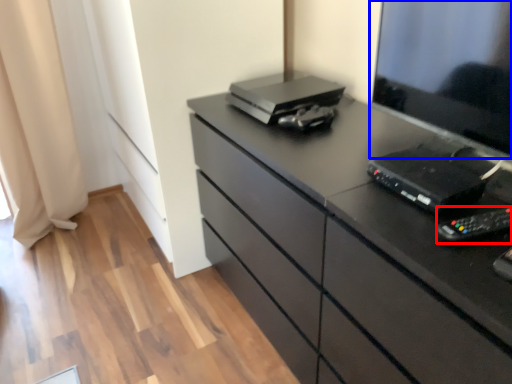
Question: Which object appears closest to the camera in this image, equipment (highlighted by a red box) or desktop (highlighted by a blue box)?

Choices:
 (A) equipment
 (B) desktop

Answer: (B)